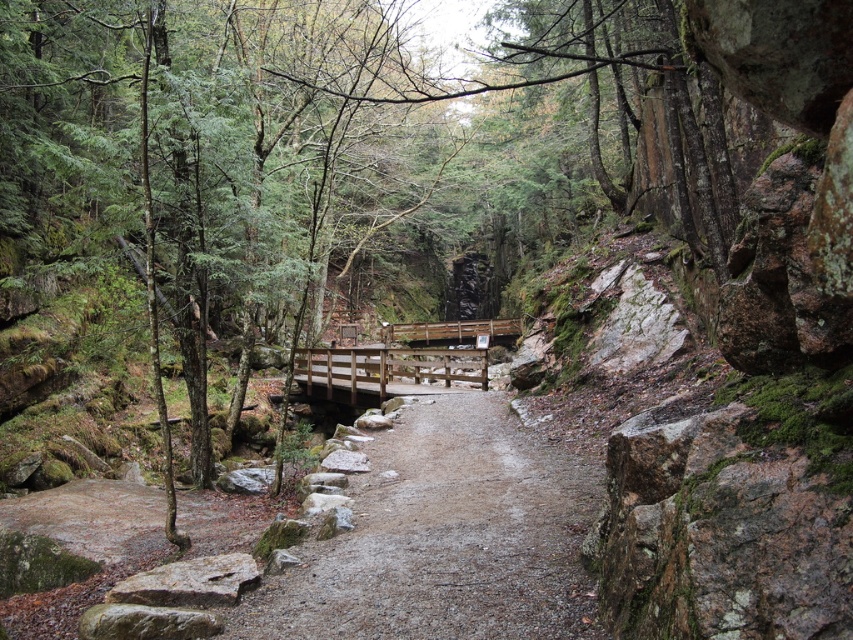
Question: Is damp gravel path at center thinner than gray rough rock at lower left?

Choices:
 (A) yes
 (B) no

Answer: (B)

Question: Which point is farther from the camera taking this photo?

Choices:
 (A) (517, 321)
 (B) (180, 592)

Answer: (A)

Question: Is wooden bridge at center bigger than gray rough rock at lower left?

Choices:
 (A) no
 (B) yes

Answer: (B)

Question: Does wooden bridge at center appear over gray rough rock at lower left?

Choices:
 (A) no
 (B) yes

Answer: (B)

Question: Which object appears closest to the camera in this image?

Choices:
 (A) gray rough rock at lower left
 (B) damp gravel path at center
 (C) wooden bridge at center

Answer: (B)

Question: Which of these objects is positioned farthest from the gray rough rock at lower left?

Choices:
 (A) damp gravel path at center
 (B) wooden bridge at center

Answer: (B)